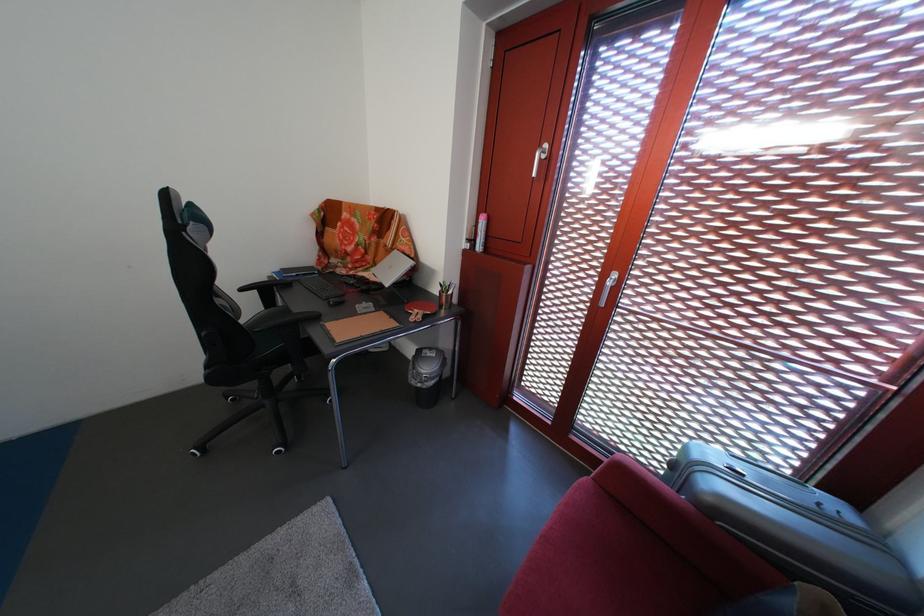
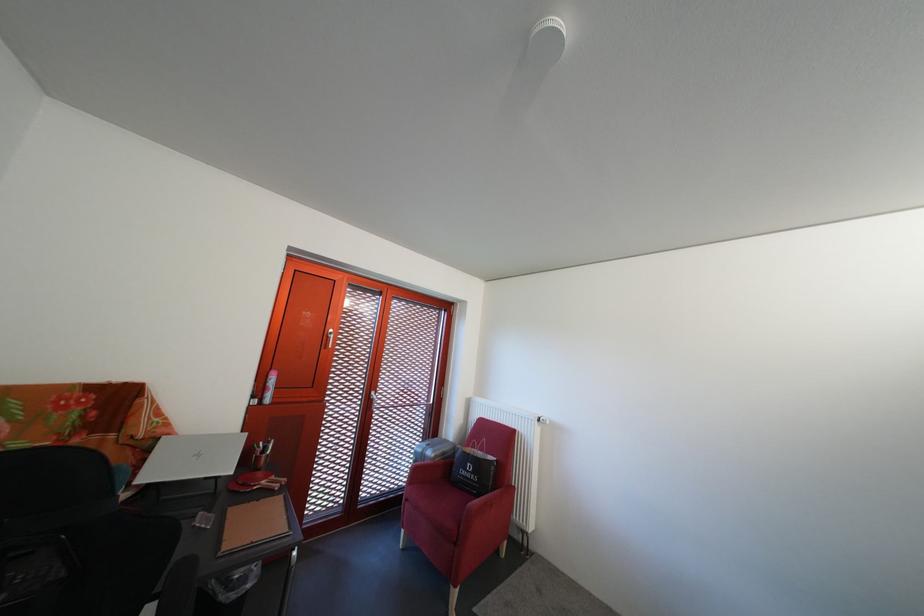
In the second image, find the point that corresponds to point 626,282 in the first image.

(383, 400)